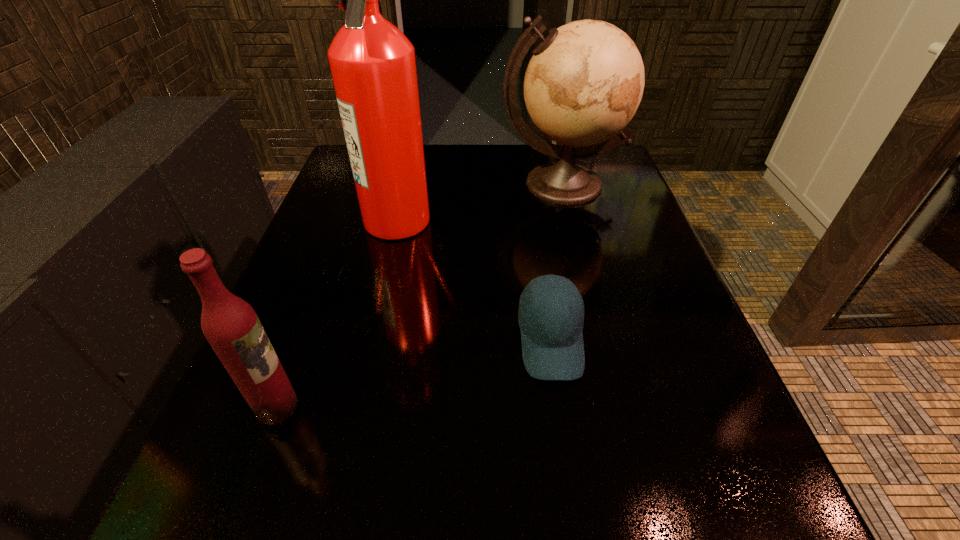
This screenshot has width=960, height=540. What are the coordinates of `free point at the far right corner` in the screenshot? It's located at (623, 174).

Identify the location of vacant space at the near right corner of the desktop. (723, 513).

The width and height of the screenshot is (960, 540). Identify the location of free area in between the baseball cap and the second shortest object. (414, 374).

This screenshot has height=540, width=960. Find the location of `vacant space that's between the third farthest object and the third shortest object`. vacant space that's between the third farthest object and the third shortest object is located at coordinates (556, 262).

Where is `vacant area that lies between the third shortest object and the second object from left to right`? vacant area that lies between the third shortest object and the second object from left to right is located at coordinates (479, 202).

Where is `free space between the leftmost object and the shortest object`? free space between the leftmost object and the shortest object is located at coordinates (414, 374).

Locate an element on the screen. The image size is (960, 540). vacant point located between the shortest object and the fire extinguisher is located at coordinates (474, 280).

This screenshot has width=960, height=540. In order to click on unoccupied position between the tallest object and the third shortest object in this screenshot , I will do `click(479, 202)`.

The height and width of the screenshot is (540, 960). Find the location of `free point between the fire extinguisher and the leftmost object`. free point between the fire extinguisher and the leftmost object is located at coordinates (337, 313).

The width and height of the screenshot is (960, 540). Identify the location of free space between the leftmost object and the baseball cap. (414, 374).